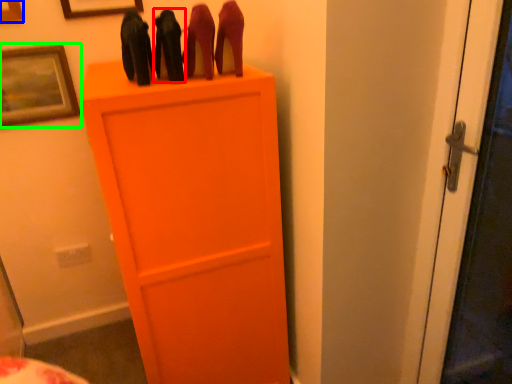
Question: Considering the real-world distances, which object is closest to stuff (highlighted by a red box)? picture frame (highlighted by a blue box) or picture frame (highlighted by a green box).

Choices:
 (A) picture frame
 (B) picture frame

Answer: (B)